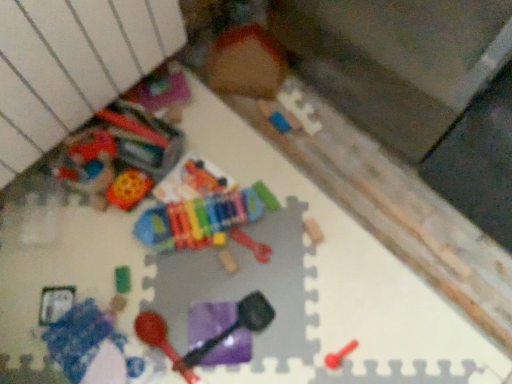
Question: Choose the correct answer: Is blue fabric blanket at lower left, which ranks as the 7th toy in right-to-left order, inside wooden xylophone at center, which ranks as the fourth toy in right-to-left order, or outside it?

Choices:
 (A) inside
 (B) outside

Answer: (B)

Question: From a real-world perspective, is blue fabric blanket at lower left, which ranks as the 7th toy in right-to-left order, positioned above or below wooden xylophone at center, which ranks as the fourth toy in right-to-left order?

Choices:
 (A) below
 (B) above

Answer: (B)

Question: Which is farther from the multicolored plastic xylophone at center, the third toy from the left?

Choices:
 (A) rubberized plastic maraca at lower center, arranged as the 6th toy when viewed from the right
 (B) smooth plastic spoon at lower right, arranged as the first toy when viewed from the right
 (C) rubber bone at center, the 6th toy when ordered from left to right
 (D) purple matte shovel at center, which is the fifth toy in left-to-right order
 (E) blue fabric blanket at lower left, which ranks as the 7th toy in right-to-left order

Answer: (B)

Question: Estimate the real-world distances between objects in this image. Which object is closer to the smooth plastic spoon at lower right, arranged as the first toy when viewed from the right?

Choices:
 (A) purple matte shovel at center, which is the fifth toy in left-to-right order
 (B) multicolored plastic xylophone at center, the third toy from the left
 (C) rubberized plastic maraca at lower center, arranged as the 6th toy when viewed from the right
 (D) wooden xylophone at center, which ranks as the fourth toy in right-to-left order
 (E) rubber bone at center, the 6th toy when ordered from left to right

Answer: (A)